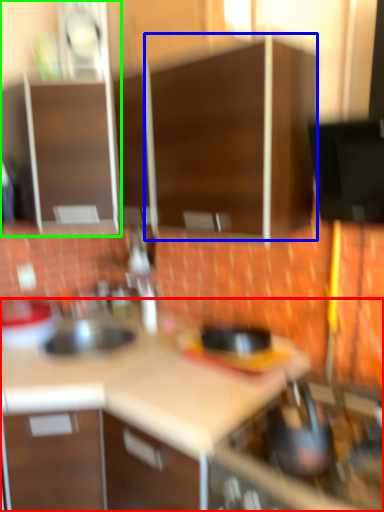
Question: Estimate the real-world distances between objects in this image. Which object is farther from countertop (highlighted by a red box), cabinetry (highlighted by a blue box) or cabinetry (highlighted by a green box)?

Choices:
 (A) cabinetry
 (B) cabinetry

Answer: (B)